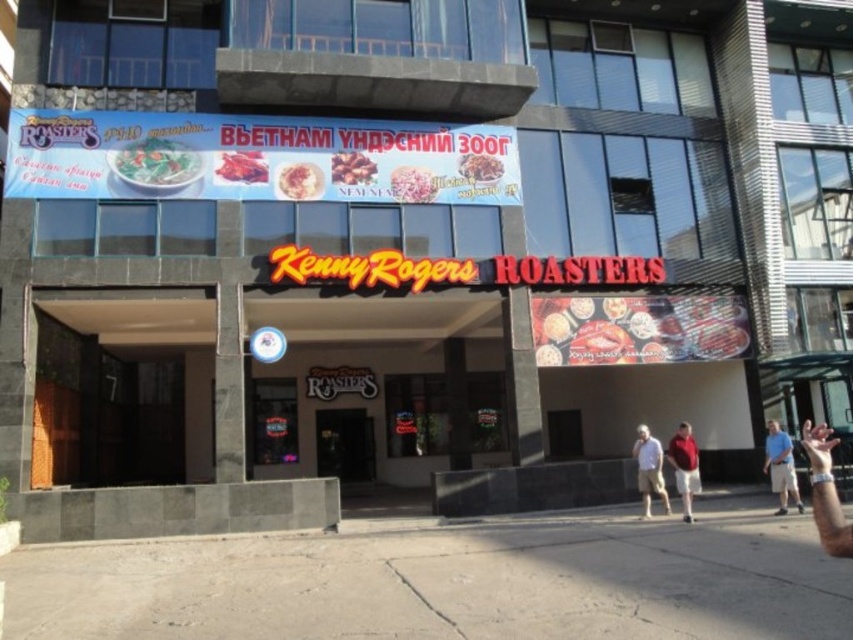
Is green leafy salad at upper left above blue denim shorts at lower right?

Yes.

Where is `green leafy salad at upper left`? This screenshot has height=640, width=853. green leafy salad at upper left is located at coordinates (155, 163).

Identify the location of green leafy salad at upper left. The height and width of the screenshot is (640, 853). (155, 163).

Between black glass door at center and smooth white rice at center, which one has more height?

black glass door at center

This screenshot has width=853, height=640. What do you see at coordinates (345, 444) in the screenshot?
I see `black glass door at center` at bounding box center [345, 444].

Where is `black glass door at center`? This screenshot has height=640, width=853. black glass door at center is located at coordinates (345, 444).

Locate an element on the screen. Image resolution: width=853 pixels, height=640 pixels. black glass door at center is located at coordinates (345, 444).

Does black glass door at center have a greater height compared to light beige shorts at center?

Yes, black glass door at center is taller than light beige shorts at center.

Between black glass door at center and light beige shorts at center, which one is positioned lower?

black glass door at center

What are the coordinates of `black glass door at center` in the screenshot? It's located at click(x=345, y=444).